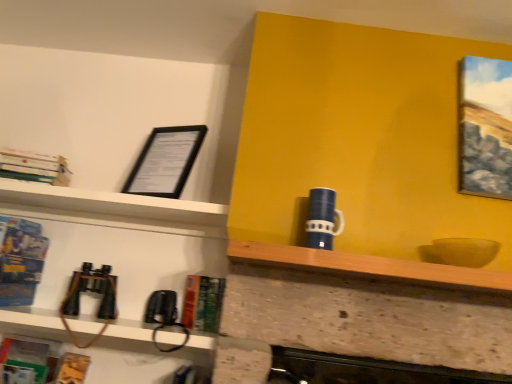
Question: From the image's perspective, is hardcover book at center, acting as the 4th book starting from the left, positioned above or below blue glossy book at left, the fourth book in the right-to-left sequence?

Choices:
 (A) above
 (B) below

Answer: (B)

Question: Is point (183, 296) closer or farther from the camera than point (26, 289)?

Choices:
 (A) closer
 (B) farther

Answer: (B)

Question: Which object is positioned farthest from the black matte picture frame at upper left?

Choices:
 (A) wooden at center
 (B) hardcover book at center, which is counted as the first book, starting from the right
 (C) hardcover books at upper left, marked as the fourth book in a bottom-to-top arrangement
 (D) blue glossy mug at upper center
 (E) blue glossy book at left, which ranks as the first book in left-to-right order

Answer: (D)

Question: Which is farther from the hardcover book at center, acting as the 4th book starting from the left?

Choices:
 (A) wooden at center
 (B) blue glossy mug at upper center
 (C) hardcover books at upper left, which ranks as the first book in top-to-bottom order
 (D) blue glossy book at left, which appears as the 3th book when ordered from the bottom
 (E) hardcover book at lower left, marked as the 1th book in a bottom-to-top arrangement

Answer: (C)